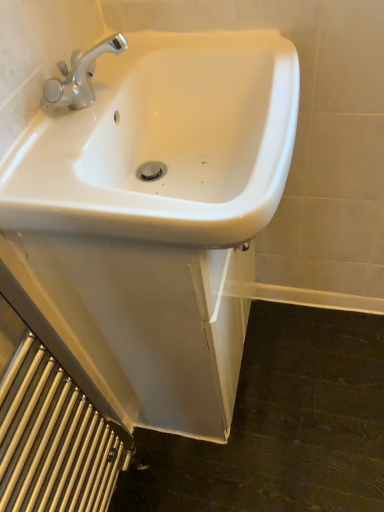
Question: Is white glossy sink at center surrounded by silver metallic radiator at lower left?

Choices:
 (A) yes
 (B) no

Answer: (B)

Question: Is silver metallic radiator at lower left bigger than white glossy sink at center?

Choices:
 (A) yes
 (B) no

Answer: (B)

Question: From a real-world perspective, is silver metallic radiator at lower left physically above white glossy sink at center?

Choices:
 (A) no
 (B) yes

Answer: (A)

Question: Is silver metallic radiator at lower left oriented away from white glossy sink at center?

Choices:
 (A) no
 (B) yes

Answer: (A)

Question: Is silver metallic radiator at lower left outside white glossy sink at center?

Choices:
 (A) yes
 (B) no

Answer: (A)

Question: Considering the relative sizes of silver metallic radiator at lower left and white glossy sink at center in the image provided, is silver metallic radiator at lower left thinner than white glossy sink at center?

Choices:
 (A) no
 (B) yes

Answer: (B)

Question: Does white glossy sink at center have a lesser height compared to silver metallic radiator at lower left?

Choices:
 (A) no
 (B) yes

Answer: (B)

Question: Is white glossy sink at center to the right of silver metallic radiator at lower left from the viewer's perspective?

Choices:
 (A) no
 (B) yes

Answer: (B)

Question: From the image's perspective, is white glossy sink at center above silver metallic radiator at lower left?

Choices:
 (A) no
 (B) yes

Answer: (B)

Question: Is white glossy sink at center further to camera compared to silver metallic radiator at lower left?

Choices:
 (A) yes
 (B) no

Answer: (A)

Question: Is white glossy sink at center directly adjacent to silver metallic radiator at lower left?

Choices:
 (A) yes
 (B) no

Answer: (B)

Question: Could silver metallic radiator at lower left be considered to be inside white glossy sink at center?

Choices:
 (A) yes
 (B) no

Answer: (B)

Question: Is white glossy sink at center in front of or behind silver metallic radiator at lower left in the image?

Choices:
 (A) front
 (B) behind

Answer: (B)